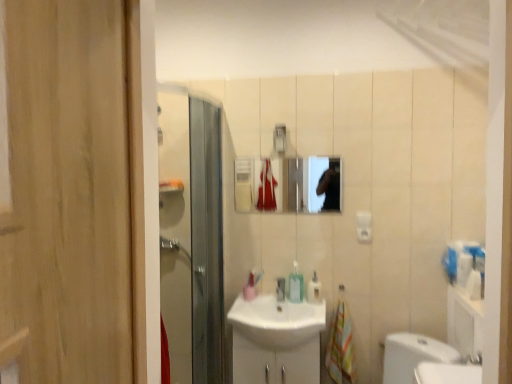
Question: Considering the relative sizes of translucent plastic soap dispenser at center, positioned as the 1th soap dispenser in left-to-right order, and translucent plastic soap dispenser at center, positioned as the 1th soap dispenser in right-to-left order, in the image provided, is translucent plastic soap dispenser at center, positioned as the 1th soap dispenser in left-to-right order, taller than translucent plastic soap dispenser at center, positioned as the 1th soap dispenser in right-to-left order,?

Choices:
 (A) yes
 (B) no

Answer: (A)

Question: Is translucent plastic soap dispenser at center, positioned as the 1th soap dispenser in left-to-right order, oriented away from translucent plastic soap dispenser at center, the second soap dispenser viewed from the left?

Choices:
 (A) no
 (B) yes

Answer: (A)

Question: Can you confirm if translucent plastic soap dispenser at center, positioned as the 1th soap dispenser in left-to-right order, is thinner than translucent plastic soap dispenser at center, the second soap dispenser viewed from the left?

Choices:
 (A) no
 (B) yes

Answer: (B)

Question: Is translucent plastic soap dispenser at center, positioned as the 1th soap dispenser in left-to-right order, behind translucent plastic soap dispenser at center, positioned as the 1th soap dispenser in right-to-left order?

Choices:
 (A) yes
 (B) no

Answer: (A)

Question: Could translucent plastic soap dispenser at center, positioned as the 1th soap dispenser in right-to-left order, be considered to be inside translucent plastic soap dispenser at center, positioned as the 1th soap dispenser in left-to-right order?

Choices:
 (A) no
 (B) yes

Answer: (A)

Question: Is point (246, 311) positioned closer to the camera than point (345, 365)?

Choices:
 (A) farther
 (B) closer

Answer: (A)

Question: In the image, is white glossy sink at center positioned in front of or behind multicolored fabric hand towel at lower right?

Choices:
 (A) behind
 (B) front

Answer: (B)

Question: Is white glossy sink at center taller or shorter than multicolored fabric hand towel at lower right?

Choices:
 (A) short
 (B) tall

Answer: (A)

Question: From a real-world perspective, is white glossy sink at center physically located above or below multicolored fabric hand towel at lower right?

Choices:
 (A) above
 (B) below

Answer: (A)

Question: Considering the positions of translucent plastic soap dispenser at center, which appears as the second soap dispenser when viewed from the right, and multicolored fabric hand towel at lower right in the image, is translucent plastic soap dispenser at center, which appears as the second soap dispenser when viewed from the right, taller or shorter than multicolored fabric hand towel at lower right?

Choices:
 (A) short
 (B) tall

Answer: (A)

Question: Visually, is translucent plastic soap dispenser at center, which appears as the second soap dispenser when viewed from the right, positioned to the left or to the right of multicolored fabric hand towel at lower right?

Choices:
 (A) right
 (B) left

Answer: (B)

Question: From a real-world perspective, is translucent plastic soap dispenser at center, which appears as the second soap dispenser when viewed from the right, positioned above or below multicolored fabric hand towel at lower right?

Choices:
 (A) below
 (B) above

Answer: (B)

Question: Is point (297, 286) closer or farther from the camera than point (349, 337)?

Choices:
 (A) closer
 (B) farther

Answer: (B)

Question: From the image's perspective, relative to white glossy sink at center, is multicolored fabric hand towel at lower right above or below?

Choices:
 (A) below
 (B) above

Answer: (B)

Question: Would you say multicolored fabric hand towel at lower right is to the left or to the right of white glossy sink at center in the picture?

Choices:
 (A) left
 (B) right

Answer: (B)